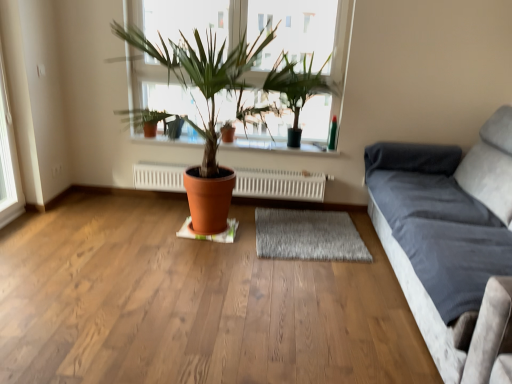
Question: From a real-world perspective, relative to white plastic window frame at left, is terracotta clay pot at center vertically above or below?

Choices:
 (A) below
 (B) above

Answer: (A)

Question: Visually, is terracotta clay pot at center positioned to the left or to the right of white plastic window frame at left?

Choices:
 (A) left
 (B) right

Answer: (B)

Question: Which is nearer to the white radiator at center?

Choices:
 (A) white plastic window frame at left
 (B) gray shaggy rug at center
 (C) green matte plant at upper center
 (D) matte glass window at center
 (E) velvet gray couch at right

Answer: (B)

Question: Based on their relative distances, which object is nearer to the matte glass window at center?

Choices:
 (A) green matte plant at upper center
 (B) velvet gray couch at right
 (C) gray shaggy rug at center
 (D) white plastic window frame at left
 (E) white radiator at center

Answer: (A)